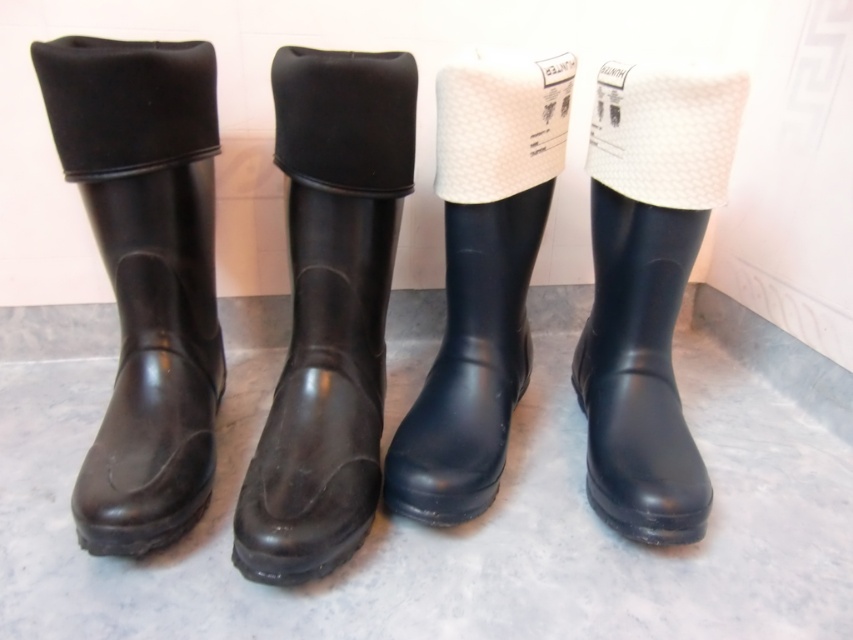
Is point (189, 445) closer to viewer compared to point (656, 304)?

Yes.

Does black rubber boot at left have a greater height compared to black rubber boot at right?

Correct, black rubber boot at left is much taller as black rubber boot at right.

Where is `black rubber boot at left`? black rubber boot at left is located at coordinates (144, 275).

Identify the location of black rubber boot at left. (144, 275).

Between black rubber boot at left and black rubber boot at center, which one has more height?

With more height is black rubber boot at center.

Between point (93, 100) and point (305, 195), which one is positioned in front?

Positioned in front is point (93, 100).

Locate an element on the screen. black rubber boot at left is located at coordinates (144, 275).

In the scene shown: Can you confirm if navy rubber boot at center is thinner than black rubber boot at right?

No, navy rubber boot at center is not thinner than black rubber boot at right.

Between navy rubber boot at center and black rubber boot at right, which one has less height?

black rubber boot at right

The height and width of the screenshot is (640, 853). Identify the location of navy rubber boot at center. (480, 278).